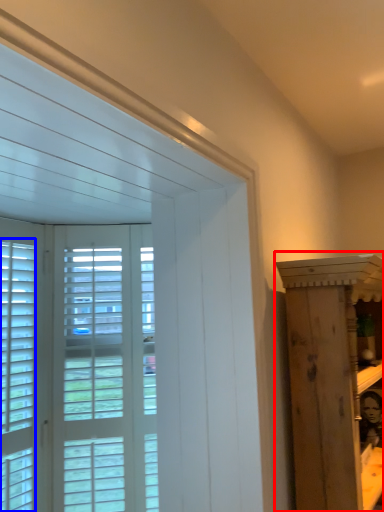
Question: Which object appears farthest to the camera in this image, furniture (highlighted by a red box) or window (highlighted by a blue box)?

Choices:
 (A) furniture
 (B) window

Answer: (B)